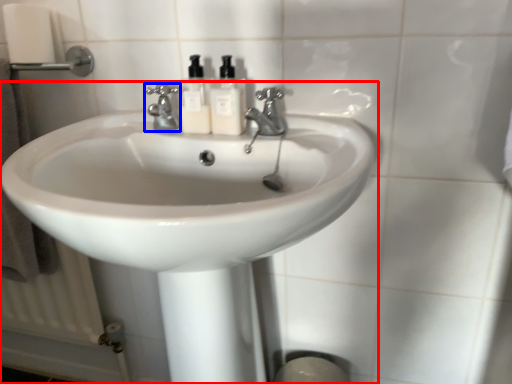
Question: Which of the following is the farthest to the observer, sink (highlighted by a red box) or tap (highlighted by a blue box)?

Choices:
 (A) sink
 (B) tap

Answer: (B)